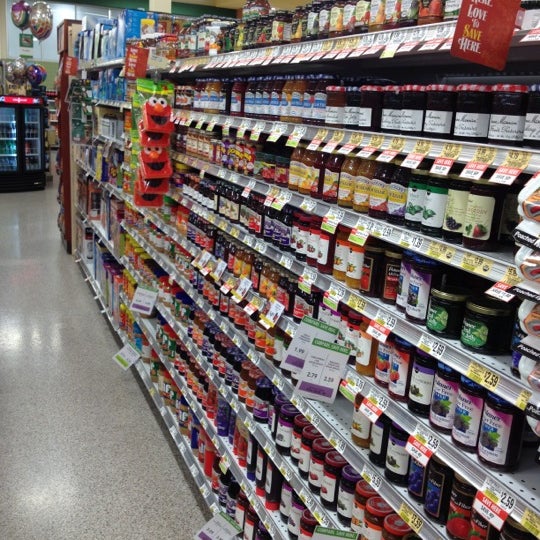
Where is `jars`? The width and height of the screenshot is (540, 540). jars is located at coordinates (433, 212).